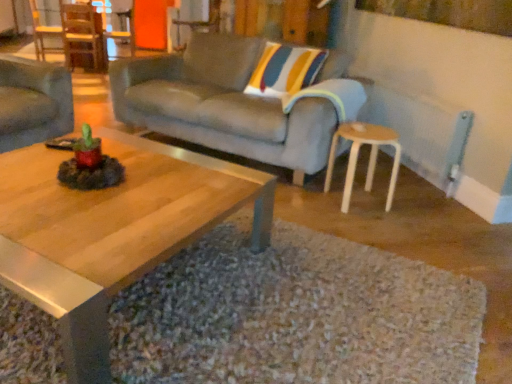
Identify the location of wooden polished coffee table at center. Image resolution: width=512 pixels, height=384 pixels. (112, 231).

This screenshot has width=512, height=384. In order to click on gray fabric couch at center, placed as the 2th studio couch when sorted from left to right in this screenshot , I will do `click(222, 104)`.

In order to face wooden chair at center, which is the first chair in right-to-left order, should I rotate leftwards or rightwards?

To face it directly, rotate left by 8.059 degrees.

At what (x,y) coordinates should I click in order to perform the action: click on wooden polished coffee table at center. Please return your answer as a coordinate pair (x, y). The width and height of the screenshot is (512, 384). Looking at the image, I should click on (112, 231).

Is wooden chair at left, which is the first chair from back to front, inside the boundaries of wooden polished coffee table at center, or outside?

wooden chair at left, which is the first chair from back to front, is outside wooden polished coffee table at center.

Based on the photo, is wooden chair at left, which is the first chair from back to front, wider or thinner than wooden polished coffee table at center?

Clearly, wooden chair at left, which is the first chair from back to front, has less width compared to wooden polished coffee table at center.

You are a GUI agent. You are given a task and a screenshot of the screen. Output one action in this format:
    pyautogui.click(x=<x>, y=<y>)
    Task: Click on the coffee table on the right side of wooden chair at left, which is the first chair from back to front
    
    Given the screenshot: What is the action you would take?
    pyautogui.click(x=112, y=231)

From the image's perspective, which is above, wooden chair at left, which is the first chair in left-to-right order, or wooden polished coffee table at center?

wooden chair at left, which is the first chair in left-to-right order, appears higher in the image.

From the image's perspective, is wooden polished coffee table at center located above or below gray fabric couch at center, placed as the 2th studio couch when sorted from left to right?

wooden polished coffee table at center is situated lower than gray fabric couch at center, placed as the 2th studio couch when sorted from left to right, in the image.

Would you say wooden polished coffee table at center is to the left or to the right of gray fabric couch at center, the 1th studio couch from the right, in the picture?

In the image, wooden polished coffee table at center appears on the left side of gray fabric couch at center, the 1th studio couch from the right.

In the scene shown: Is wooden polished coffee table at center looking in the opposite direction of gray fabric couch at center, placed as the 2th studio couch when sorted from left to right?

Yes, gray fabric couch at center, placed as the 2th studio couch when sorted from left to right, is at the back of wooden polished coffee table at center.

Between point (261, 240) and point (269, 140), which one is positioned behind?

The point (269, 140) is behind.

Can you confirm if wooden chair at center, which is the first chair in right-to-left order, is bigger than gray fabric couch at center, the 1th studio couch from the right?

No, wooden chair at center, which is the first chair in right-to-left order, is not bigger than gray fabric couch at center, the 1th studio couch from the right.

From a real-world perspective, is wooden chair at center, the second chair viewed from the back, positioned under gray fabric couch at center, the 1th studio couch from the right, based on gravity?

No, from a real-world perspective, wooden chair at center, the second chair viewed from the back, is not beneath gray fabric couch at center, the 1th studio couch from the right.

Is wooden chair at center, which is the 2th chair in left-to-right order, next to gray fabric couch at center, the 1th studio couch from the right?

No, wooden chair at center, which is the 2th chair in left-to-right order, is not with gray fabric couch at center, the 1th studio couch from the right.

Who is bigger, wooden chair at center, which is the first chair from front to back, or white plastic stool at lower right?

Bigger between the two is wooden chair at center, which is the first chair from front to back.

Considering the positions of point (177, 24) and point (369, 175), is point (177, 24) closer or farther from the camera than point (369, 175)?

Point (177, 24) is farther from the camera than point (369, 175).

Between wooden chair at center, the second chair viewed from the back, and white plastic stool at lower right, which one has larger width?

Wider between the two is wooden chair at center, the second chair viewed from the back.

Is wooden polished coffee table at center not close to wooden chair at center, the second chair viewed from the back?

wooden polished coffee table at center is far away from wooden chair at center, the second chair viewed from the back.

Considering the relative positions of wooden polished coffee table at center and wooden chair at center, which is the 2th chair in left-to-right order, in the image provided, is wooden polished coffee table at center to the left of wooden chair at center, which is the 2th chair in left-to-right order, from the viewer's perspective?

No, wooden polished coffee table at center is not to the left of wooden chair at center, which is the 2th chair in left-to-right order.

From their relative heights in the image, would you say wooden polished coffee table at center is taller or shorter than wooden chair at center, which is the 2th chair in left-to-right order?

wooden polished coffee table at center is shorter than wooden chair at center, which is the 2th chair in left-to-right order.

I want to click on coffee table lying on the right of wooden chair at left, which is the first chair from back to front, so click(112, 231).

From the image's perspective, is wooden polished coffee table at center above wooden chair at left, the second chair viewed from the front?

No, from the image's perspective, wooden polished coffee table at center is not over wooden chair at left, the second chair viewed from the front.

Between wooden polished coffee table at center and wooden chair at left, placed as the 2th chair when sorted from right to left, which one is positioned in front?

wooden polished coffee table at center is in front.

What's the angular difference between wooden polished coffee table at center and wooden chair at left, placed as the 2th chair when sorted from right to left,'s facing directions?

There is a 134-degree angle between the facing directions of wooden polished coffee table at center and wooden chair at left, placed as the 2th chair when sorted from right to left.

Considering the positions of objects wooden chair at center, which is the 2th chair in left-to-right order, and wooden chair at left, the second chair viewed from the front, in the image provided, who is in front, wooden chair at center, which is the 2th chair in left-to-right order, or wooden chair at left, the second chair viewed from the front,?

Positioned in front is wooden chair at center, which is the 2th chair in left-to-right order.

Considering the sizes of objects wooden chair at center, the second chair viewed from the back, and wooden chair at left, placed as the 2th chair when sorted from right to left, in the image provided, who is shorter, wooden chair at center, the second chair viewed from the back, or wooden chair at left, placed as the 2th chair when sorted from right to left,?

Standing shorter between the two is wooden chair at center, the second chair viewed from the back.

In terms of width, does wooden chair at center, which is the first chair from front to back, look wider or thinner when compared to wooden chair at left, which is the first chair in left-to-right order?

In the image, wooden chair at center, which is the first chair from front to back, appears to be wider than wooden chair at left, which is the first chair in left-to-right order.

How many degrees apart are the facing directions of wooden chair at center, which is the first chair in right-to-left order, and wooden chair at left, the second chair viewed from the front?

wooden chair at center, which is the first chair in right-to-left order, and wooden chair at left, the second chair viewed from the front, are facing 178 degrees away from each other.

Find the location of a particular element. The width and height of the screenshot is (512, 384). coffee table directly beneath the wooden chair at left, which is the first chair in left-to-right order (from a real-world perspective) is located at coordinates point(112,231).

Identify the location of coffee table in front of the gray fabric couch at center, placed as the 2th studio couch when sorted from left to right. The image size is (512, 384). (112, 231).

Based on their spatial positions, is white plastic stool at lower right or wooden chair at left, which is the first chair in left-to-right order, closer to wooden chair at center, which is the 2th chair in left-to-right order?

white plastic stool at lower right lies closer to wooden chair at center, which is the 2th chair in left-to-right order, than the other object.

Based on their spatial positions, is white plastic stool at lower right or matte gray couch at left, positioned as the second studio couch in right-to-left order, further from gray fabric couch at center, placed as the 2th studio couch when sorted from left to right?

matte gray couch at left, positioned as the second studio couch in right-to-left order, is positioned further to the anchor gray fabric couch at center, placed as the 2th studio couch when sorted from left to right.

Which object lies nearer to the anchor point gray fabric couch at center, the 1th studio couch from the right, wooden chair at left, which is the first chair in left-to-right order, or wooden chair at center, which is the first chair in right-to-left order?

Among the two, wooden chair at center, which is the first chair in right-to-left order, is located nearer to gray fabric couch at center, the 1th studio couch from the right.

From the image, which object appears to be farther from white plastic stool at lower right, wooden chair at left, which is the first chair in left-to-right order, or gray fabric couch at center, placed as the 2th studio couch when sorted from left to right?

Among the two, wooden chair at left, which is the first chair in left-to-right order, is located further to white plastic stool at lower right.

Based on their spatial positions, is wooden chair at left, which is the first chair from back to front, or wooden polished coffee table at center further from gray fabric couch at center, placed as the 2th studio couch when sorted from left to right?

The object further to gray fabric couch at center, placed as the 2th studio couch when sorted from left to right, is wooden chair at left, which is the first chair from back to front.

Considering their positions, is wooden chair at center, which is the 2th chair in left-to-right order, positioned further to gray fabric couch at center, the 1th studio couch from the right, than wooden polished coffee table at center?

wooden chair at center, which is the 2th chair in left-to-right order.

Looking at the image, which one is located further to wooden polished coffee table at center, wooden chair at center, which is the first chair from front to back, or gray fabric couch at center, the 1th studio couch from the right?

Based on the image, wooden chair at center, which is the first chair from front to back, appears to be further to wooden polished coffee table at center.

When comparing their distances from white plastic stool at lower right, does wooden chair at center, which is the 2th chair in left-to-right order, or wooden polished coffee table at center seem further?

wooden chair at center, which is the 2th chair in left-to-right order.

Image resolution: width=512 pixels, height=384 pixels. Identify the location of stool located between wooden polished coffee table at center and wooden chair at left, the second chair viewed from the front, in the depth direction. pyautogui.click(x=369, y=157).

At what (x,y) coordinates should I click in order to perform the action: click on chair between gray fabric couch at center, placed as the 2th studio couch when sorted from left to right, and wooden chair at left, the second chair viewed from the front, from front to back. Please return your answer as a coordinate pair (x, y). The width and height of the screenshot is (512, 384). Looking at the image, I should click on (200, 22).

You are a GUI agent. You are given a task and a screenshot of the screen. Output one action in this format:
    pyautogui.click(x=<x>, y=<y>)
    Task: Click on the studio couch between matte gray couch at left, which is the 1th studio couch in left-to-right order, and wooden chair at center, the second chair viewed from the back, in the front-back direction
    
    Given the screenshot: What is the action you would take?
    pyautogui.click(x=222, y=104)

Identify the location of coffee table situated between matte gray couch at left, which is the 1th studio couch in left-to-right order, and white plastic stool at lower right from left to right. (112, 231).